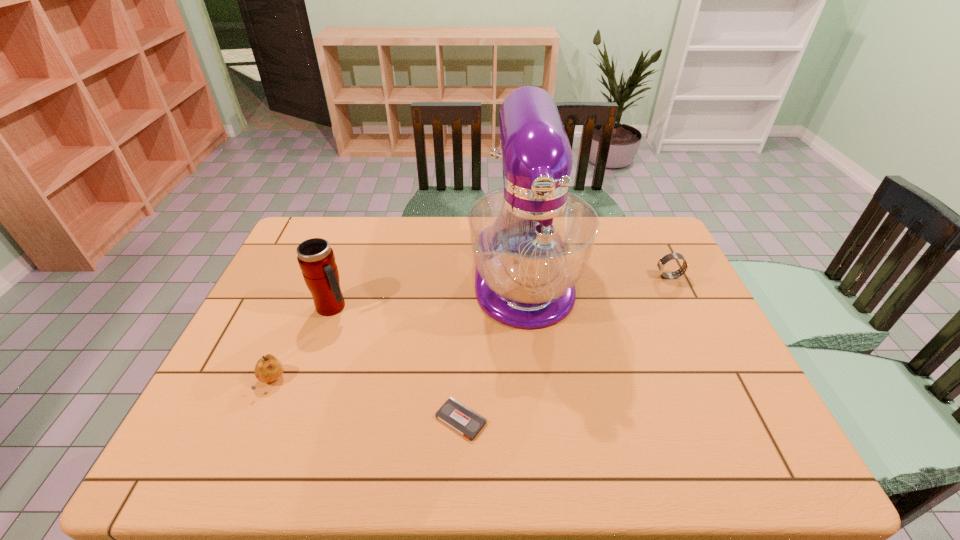
Identify the location of mixer. (531, 240).

I want to click on thermos bottle, so click(x=316, y=259).

The image size is (960, 540). I want to click on the fourth object from right to left, so click(316, 259).

At what (x,y) coordinates should I click in order to perform the action: click on the leftmost object. Please return your answer as a coordinate pair (x, y). The image size is (960, 540). Looking at the image, I should click on (268, 368).

Where is `pear`? The image size is (960, 540). pear is located at coordinates (268, 368).

The height and width of the screenshot is (540, 960). What are the coordinates of `the rightmost object` in the screenshot? It's located at (661, 263).

Where is `videotape`? This screenshot has height=540, width=960. videotape is located at coordinates (465, 421).

The image size is (960, 540). In order to click on the nearest object in this screenshot , I will do `click(465, 421)`.

Find the location of a particular element. The image size is (960, 540). vacant space located at the bowl opening of the tallest object is located at coordinates (533, 362).

Locate an element on the screen. Image resolution: width=960 pixels, height=540 pixels. vacant region located 0.400m on the side with the handle of the second object from left to right is located at coordinates (489, 307).